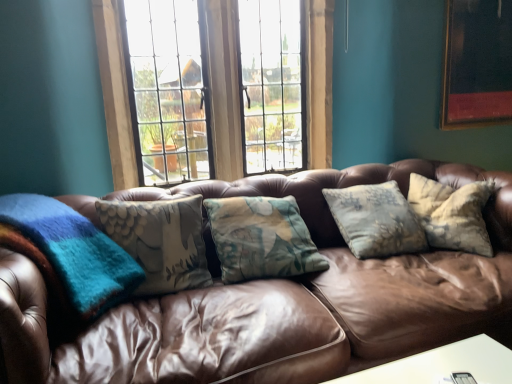
Question: Does wooden picture frame at upper right have a greater width compared to brown leather couch at center?

Choices:
 (A) yes
 (B) no

Answer: (B)

Question: Is brown leather couch at center surrounded by wooden picture frame at upper right?

Choices:
 (A) no
 (B) yes

Answer: (A)

Question: From the image's perspective, would you say wooden picture frame at upper right is positioned over brown leather couch at center?

Choices:
 (A) no
 (B) yes

Answer: (B)

Question: Considering the relative sizes of wooden picture frame at upper right and brown leather couch at center in the image provided, is wooden picture frame at upper right shorter than brown leather couch at center?

Choices:
 (A) no
 (B) yes

Answer: (B)

Question: Is wooden picture frame at upper right in contact with brown leather couch at center?

Choices:
 (A) yes
 (B) no

Answer: (B)

Question: From the image's perspective, is brown leather couch at center above or below wooden picture frame at upper right?

Choices:
 (A) above
 (B) below

Answer: (B)

Question: Considering the positions of brown leather couch at center and wooden picture frame at upper right in the image, is brown leather couch at center wider or thinner than wooden picture frame at upper right?

Choices:
 (A) wide
 (B) thin

Answer: (A)

Question: Is brown leather couch at center taller or shorter than wooden picture frame at upper right?

Choices:
 (A) tall
 (B) short

Answer: (A)

Question: Which is correct: brown leather couch at center is inside wooden picture frame at upper right, or outside of it?

Choices:
 (A) outside
 (B) inside

Answer: (A)

Question: Looking at their shapes, would you say wooden picture frame at upper right is wider or thinner than wooden frame window at center?

Choices:
 (A) thin
 (B) wide

Answer: (A)

Question: Is point (466, 36) positioned closer to the camera than point (314, 119)?

Choices:
 (A) closer
 (B) farther

Answer: (A)

Question: Considering the relative positions of wooden picture frame at upper right and wooden frame window at center in the image provided, is wooden picture frame at upper right to the left or to the right of wooden frame window at center?

Choices:
 (A) right
 (B) left

Answer: (A)

Question: Choose the correct answer: Is wooden picture frame at upper right inside wooden frame window at center or outside it?

Choices:
 (A) inside
 (B) outside

Answer: (B)

Question: Looking at their shapes, would you say wooden frame window at center is wider or thinner than brown leather couch at center?

Choices:
 (A) thin
 (B) wide

Answer: (A)

Question: In terms of height, does wooden frame window at center look taller or shorter compared to brown leather couch at center?

Choices:
 (A) tall
 (B) short

Answer: (A)